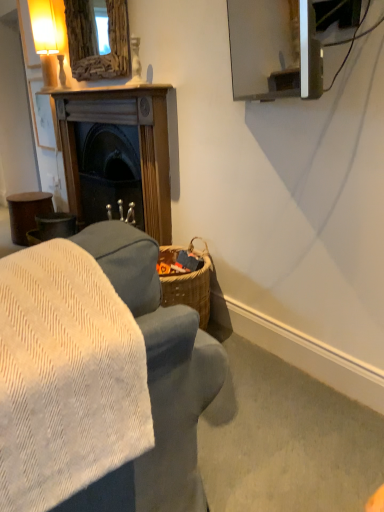
Question: Can you confirm if wooden fireplace at left is positioned to the left of velvet gray couch at lower left?

Choices:
 (A) yes
 (B) no

Answer: (B)

Question: From the image's perspective, is wooden fireplace at left below velvet gray couch at lower left?

Choices:
 (A) no
 (B) yes

Answer: (A)

Question: Is wooden fireplace at left positioned before velvet gray couch at lower left?

Choices:
 (A) yes
 (B) no

Answer: (B)

Question: Is wooden fireplace at left wider than velvet gray couch at lower left?

Choices:
 (A) no
 (B) yes

Answer: (A)

Question: Does wooden fireplace at left come behind velvet gray couch at lower left?

Choices:
 (A) no
 (B) yes

Answer: (B)

Question: From the image's perspective, is wooden fireplace at left located above or below wooden mirror at upper center?

Choices:
 (A) below
 (B) above

Answer: (A)

Question: Considering the positions of point (158, 208) and point (114, 66), is point (158, 208) closer or farther from the camera than point (114, 66)?

Choices:
 (A) closer
 (B) farther

Answer: (A)

Question: Considering the positions of wooden fireplace at left and wooden mirror at upper center in the image, is wooden fireplace at left taller or shorter than wooden mirror at upper center?

Choices:
 (A) tall
 (B) short

Answer: (A)

Question: Is wooden fireplace at left in front of or behind wooden mirror at upper center in the image?

Choices:
 (A) front
 (B) behind

Answer: (A)

Question: Considering the positions of point (119, 66) and point (56, 45), is point (119, 66) closer or farther from the camera than point (56, 45)?

Choices:
 (A) farther
 (B) closer

Answer: (B)

Question: Would you say wooden mirror at upper center is to the left or to the right of matte glass table lamp at upper left in the picture?

Choices:
 (A) left
 (B) right

Answer: (B)

Question: Do you think wooden mirror at upper center is within matte glass table lamp at upper left, or outside of it?

Choices:
 (A) inside
 (B) outside

Answer: (B)

Question: Is wooden mirror at upper center in front of or behind matte glass table lamp at upper left in the image?

Choices:
 (A) behind
 (B) front

Answer: (B)

Question: Considering the relative positions of wooden fireplace at left and matte glass table lamp at upper left in the image provided, is wooden fireplace at left to the left or to the right of matte glass table lamp at upper left?

Choices:
 (A) left
 (B) right

Answer: (B)

Question: In terms of height, does wooden fireplace at left look taller or shorter compared to matte glass table lamp at upper left?

Choices:
 (A) tall
 (B) short

Answer: (A)